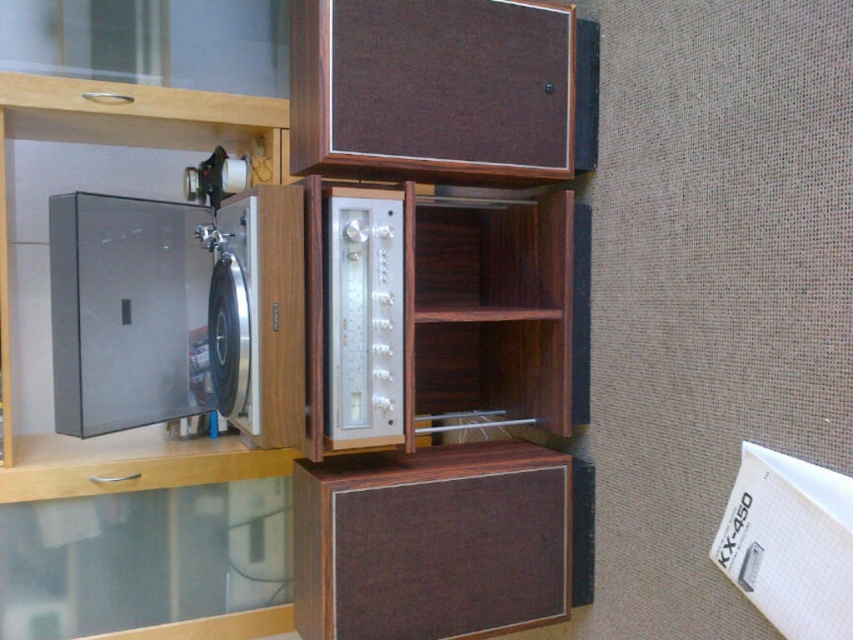
You are standing in front of the vintage audio setup. There is a point marked at coordinates (x=126, y=312). Which object from the scene does this point belong to?

The point at coordinates (x=126, y=312) corresponds to the metallic silver record player at left.